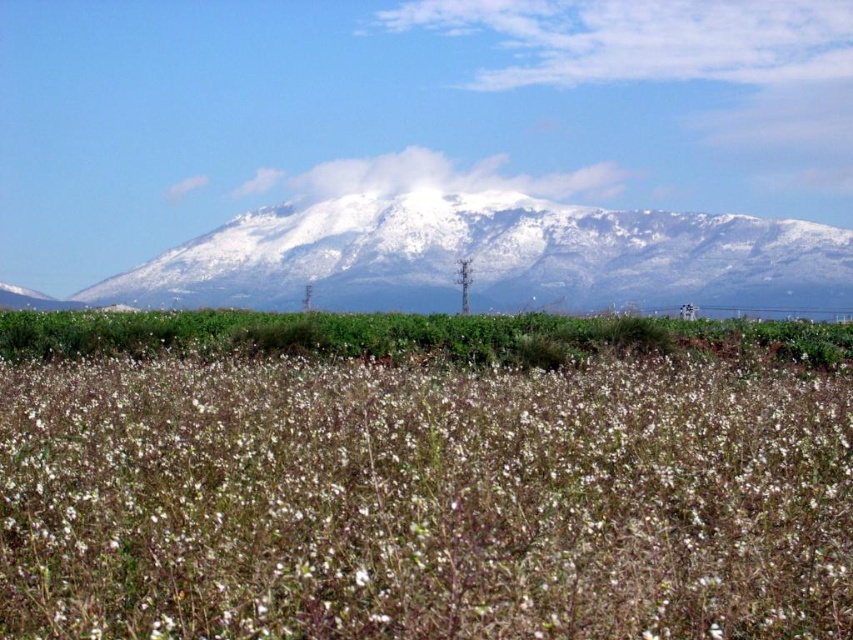
You are a photographer standing in the field of wildflowers. You want to take a photo of the white fluffy plant at center so that it appears large and clear in the image. Should you move closer to or farther away from the plant?

The white fluffy plant at center is 3.89 meters from camera. To make it appear larger and clearer in the photo, you should move closer to the plant.